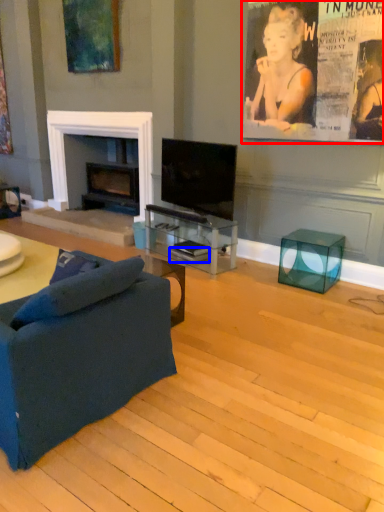
Question: Among these objects, which one is farthest to the camera, poster page (highlighted by a red box) or magazine (highlighted by a blue box)?

Choices:
 (A) poster page
 (B) magazine

Answer: (B)